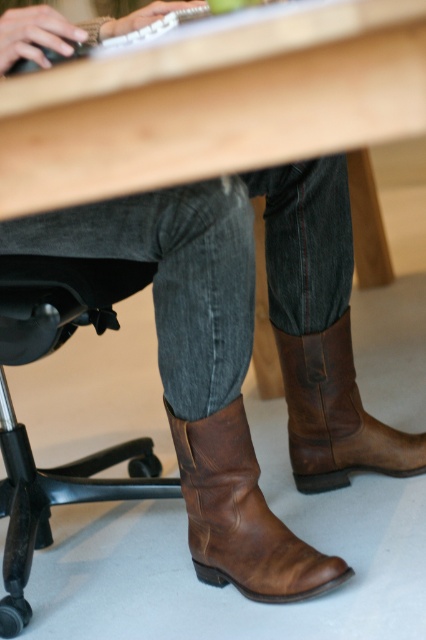
You are a tailor measuring the brown leather cowboy boot at lower center and the brown leather cowboy boot at lower right for custom insoles. Which boot requires a wider insole?

The brown leather cowboy boot at lower center requires a wider insole because its width is larger than the brown leather cowboy boot at lower right.

You are a photographer adjusting your camera to capture the scene. You notice two points marked in the image. Which point, point (x=261, y=579) or point (x=339, y=337), appears closer to your camera lens?

Point (x=261, y=579) is closer to the viewer than point (x=339, y=337), so it appears closer to the camera lens.

You are a delivery robot that needs to place a small package between the brown leather cowboy boot at lower center and the brown leather cowboy boot at lower right. The package is 30 centimeters long. Can you fit the package between them?

The distance between the brown leather cowboy boot at lower center and the brown leather cowboy boot at lower right is 29.22 centimeters. Since the package is 30 centimeters long, it cannot fit between them as the space is slightly smaller than the package.